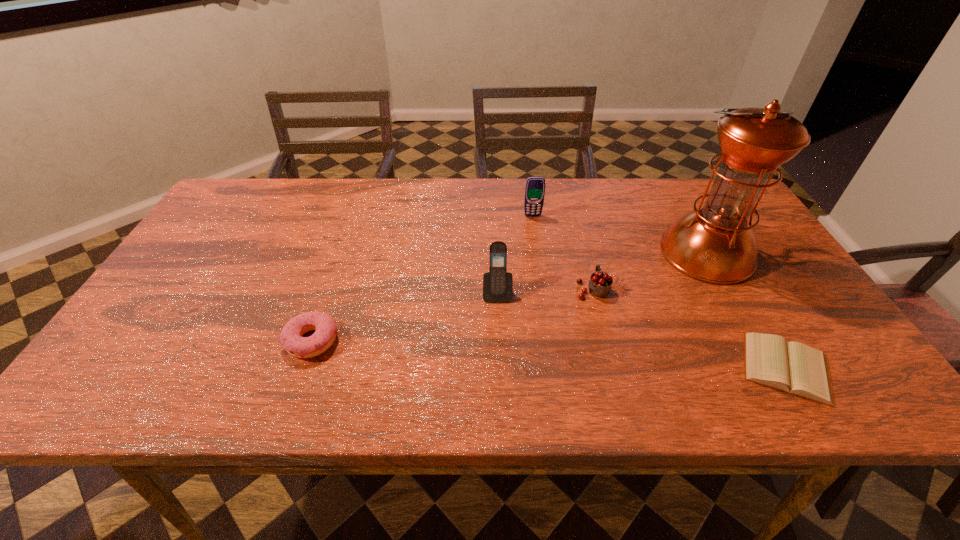
In order to click on free space located 0.330m on the front of the tallest object in this screenshot , I will do `click(792, 406)`.

You are a GUI agent. You are given a task and a screenshot of the screen. Output one action in this format:
    pyautogui.click(x=<x>, y=<y>)
    Task: Click on the vacant area situated on the front-facing side of the nearer cellular telephone
    
    Given the screenshot: What is the action you would take?
    pyautogui.click(x=498, y=323)

Find the location of a particular element. This screenshot has height=540, width=960. free space located 0.140m on the front-facing side of the right cellular telephone is located at coordinates (538, 248).

In order to click on vacant region located on the handle side of the fourth tallest object in this screenshot , I will do `click(577, 228)`.

This screenshot has width=960, height=540. In order to click on vacant area located 0.250m on the handle side of the fourth tallest object in this screenshot , I will do `click(574, 218)`.

I want to click on vacant region located on the handle side of the fourth tallest object, so click(572, 210).

Where is `vacant point located 0.340m on the left of the fifth tallest object`? vacant point located 0.340m on the left of the fifth tallest object is located at coordinates (131, 341).

This screenshot has width=960, height=540. Identify the location of blank space located 0.350m on the left of the diary. (571, 368).

This screenshot has width=960, height=540. Find the location of `object that is at the far edge`. object that is at the far edge is located at coordinates (535, 186).

The width and height of the screenshot is (960, 540). In order to click on object that is at the near edge in this screenshot , I will do `click(795, 368)`.